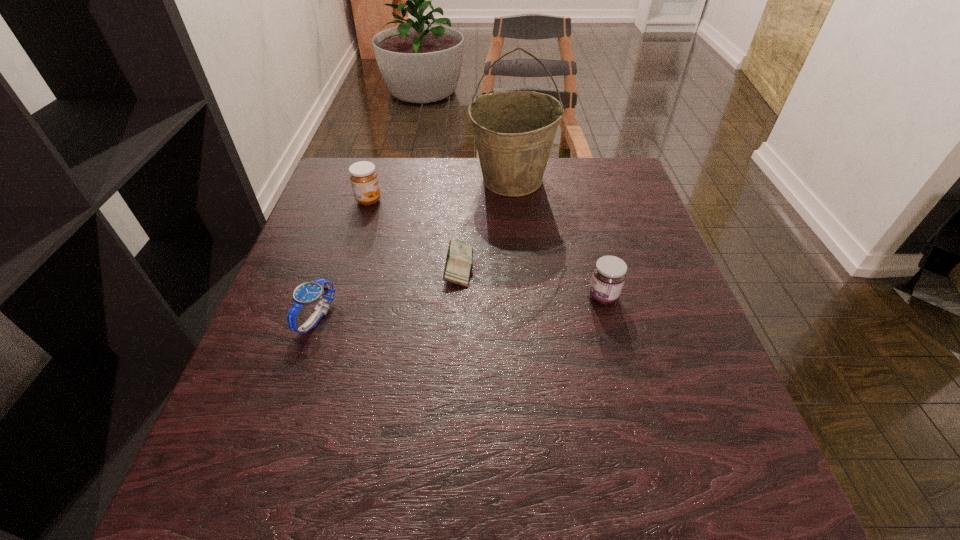
Image resolution: width=960 pixels, height=540 pixels. Find the location of `the tallest object`. the tallest object is located at coordinates (514, 132).

Image resolution: width=960 pixels, height=540 pixels. I want to click on the farther jam, so click(x=364, y=178).

Locate an element on the screen. The image size is (960, 540). the rightmost object is located at coordinates (609, 274).

Identify the location of the right jam. (609, 274).

Locate an element on the screen. This screenshot has height=540, width=960. the second shortest object is located at coordinates coord(308,293).

The height and width of the screenshot is (540, 960). I want to click on diary, so point(458,263).

Find the location of `vacant area situated 0.320m on the front of the wine bucket`. vacant area situated 0.320m on the front of the wine bucket is located at coordinates (522, 298).

Locate an element on the screen. This screenshot has width=960, height=540. free space located on the front label of the farther jam is located at coordinates coord(512,200).

Locate an element on the screen. Image resolution: width=960 pixels, height=540 pixels. vacant space positioned 0.180m on the front label of the rightmost object is located at coordinates (500, 297).

At what (x,y) coordinates should I click in order to perform the action: click on free space located 0.390m on the front label of the rightmost object. Please return your answer as a coordinate pair (x, y). Looking at the image, I should click on (398, 297).